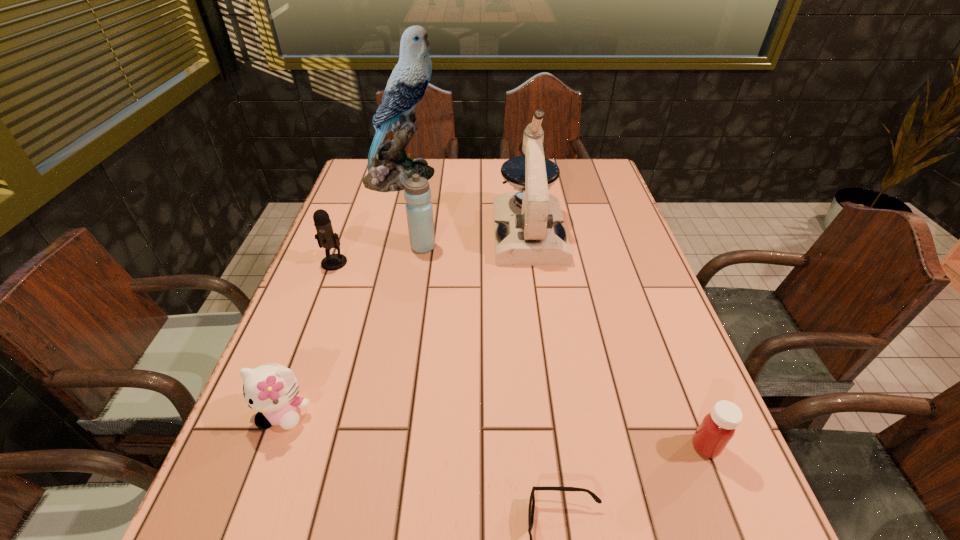
Where is `the farthest object`? The width and height of the screenshot is (960, 540). the farthest object is located at coordinates (389, 166).

Where is `the tallest object`? This screenshot has width=960, height=540. the tallest object is located at coordinates (389, 166).

In order to click on microscope in this screenshot , I will do pos(529,230).

Identify the location of the fifth shortest object. (417, 193).

Image resolution: width=960 pixels, height=540 pixels. What are the coordinates of `microphone` in the screenshot? It's located at (326, 238).

Where is `kitten`? The width and height of the screenshot is (960, 540). kitten is located at coordinates (271, 389).

Locate an element on the screen. The image size is (960, 540). medicine is located at coordinates (717, 428).

Image resolution: width=960 pixels, height=540 pixels. What are the coordinates of `free space located on the face of the farthest object` in the screenshot? It's located at (557, 177).

The image size is (960, 540). I want to click on vacant space located at the eyepiece of the sixth shortest object, so click(x=549, y=382).

This screenshot has width=960, height=540. Find the location of `free space located 0.130m on the left of the water bottle`. free space located 0.130m on the left of the water bottle is located at coordinates (364, 247).